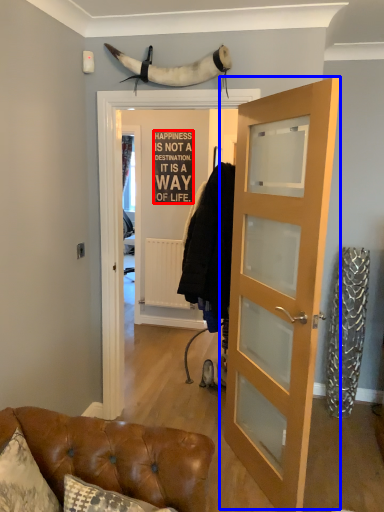
Question: Which of the following is the farthest to the observer, writing (highlighted by a red box) or door (highlighted by a blue box)?

Choices:
 (A) writing
 (B) door

Answer: (A)